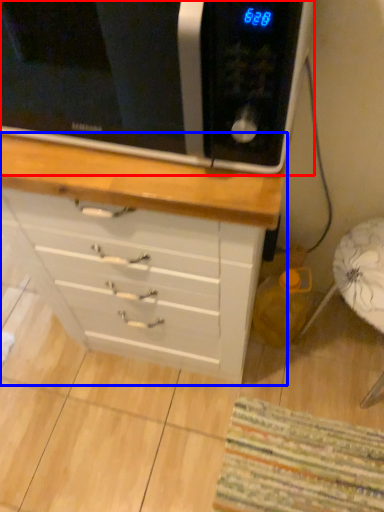
Question: Which object appears closest to the camera in this image, microwave oven (highlighted by a red box) or chest of drawers (highlighted by a blue box)?

Choices:
 (A) microwave oven
 (B) chest of drawers

Answer: (A)